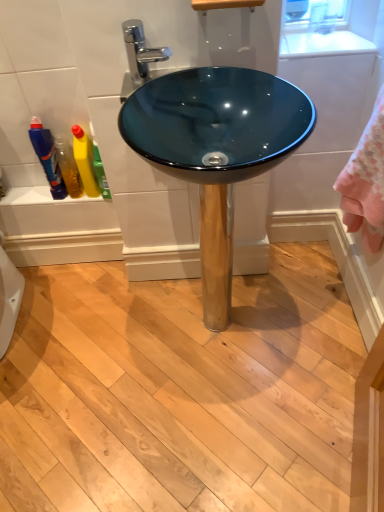
Image resolution: width=384 pixels, height=512 pixels. I want to click on vacant region to the left of translucent plastic bottles at left, so click(37, 193).